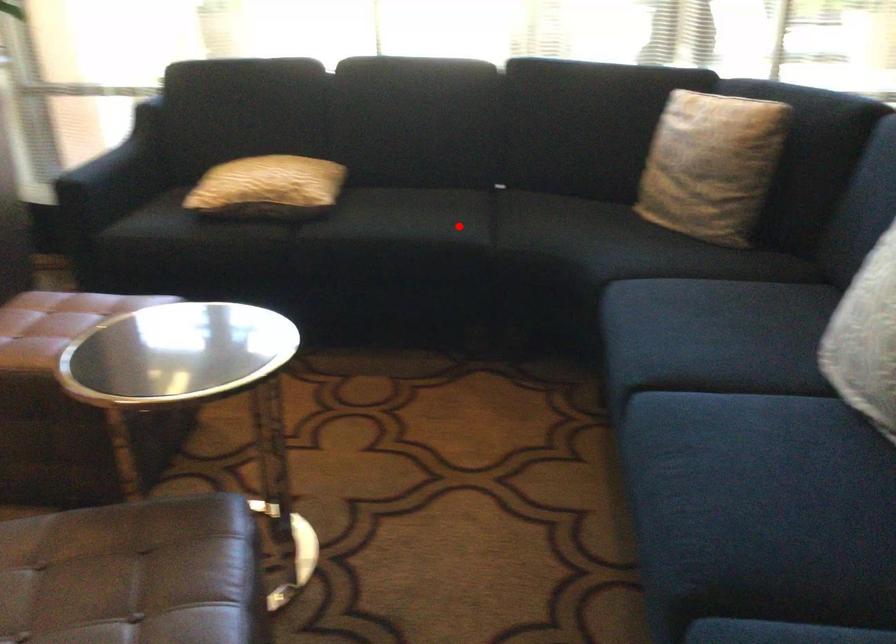
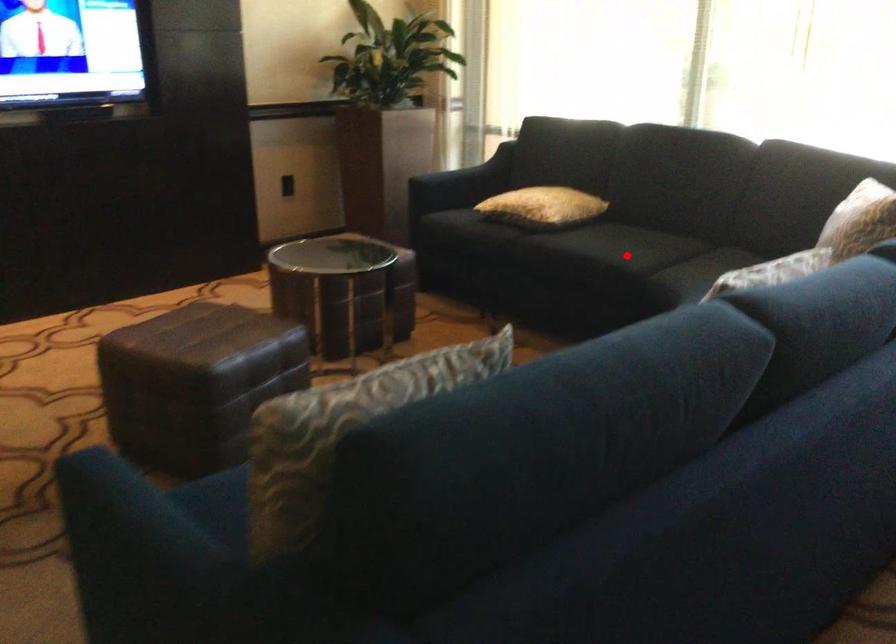
Looking at this image, I am providing you with two images of the same scene from different viewpoints. A red point is marked on the first image and another point is marked on the second image. Is the red point in image1 aligned with the point shown in image2?

Yes